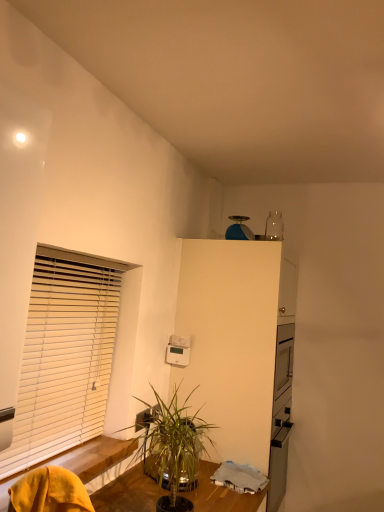
Question: Does yellow fabric swivel chair at lower left appear on the left side of green leafy plant at lower center?

Choices:
 (A) yes
 (B) no

Answer: (A)

Question: Is yellow fabric swivel chair at lower left smaller than green leafy plant at lower center?

Choices:
 (A) no
 (B) yes

Answer: (B)

Question: From a real-world perspective, is yellow fabric swivel chair at lower left below green leafy plant at lower center?

Choices:
 (A) no
 (B) yes

Answer: (A)

Question: Considering the relative sizes of yellow fabric swivel chair at lower left and green leafy plant at lower center in the image provided, is yellow fabric swivel chair at lower left thinner than green leafy plant at lower center?

Choices:
 (A) yes
 (B) no

Answer: (A)

Question: From the image's perspective, does yellow fabric swivel chair at lower left appear higher than green leafy plant at lower center?

Choices:
 (A) no
 (B) yes

Answer: (B)

Question: Is blue matte ball at upper center, which is counted as the first appliance, starting from the right, to the left or to the right of yellow fabric swivel chair at lower left in the image?

Choices:
 (A) right
 (B) left

Answer: (A)

Question: From the image's perspective, is blue matte ball at upper center, arranged as the 1th appliance when viewed from the top, located above or below yellow fabric swivel chair at lower left?

Choices:
 (A) above
 (B) below

Answer: (A)

Question: Considering the positions of point (243, 227) and point (56, 490), is point (243, 227) closer or farther from the camera than point (56, 490)?

Choices:
 (A) closer
 (B) farther

Answer: (B)

Question: Looking at their shapes, would you say blue matte ball at upper center, arranged as the 2th appliance when ordered from the bottom, is wider or thinner than yellow fabric swivel chair at lower left?

Choices:
 (A) wide
 (B) thin

Answer: (B)

Question: In terms of width, does white matte dresser at center look wider or thinner when compared to white wooden blinds at left?

Choices:
 (A) thin
 (B) wide

Answer: (B)

Question: From their relative heights in the image, would you say white matte dresser at center is taller or shorter than white wooden blinds at left?

Choices:
 (A) tall
 (B) short

Answer: (A)

Question: Do you think white matte dresser at center is within white wooden blinds at left, or outside of it?

Choices:
 (A) outside
 (B) inside

Answer: (A)

Question: From the image's perspective, is white matte dresser at center positioned above or below white wooden blinds at left?

Choices:
 (A) below
 (B) above

Answer: (A)

Question: Is white matte dresser at center inside the boundaries of green leafy plant at lower center, or outside?

Choices:
 (A) inside
 (B) outside

Answer: (B)

Question: Is white matte dresser at center taller or shorter than green leafy plant at lower center?

Choices:
 (A) tall
 (B) short

Answer: (A)